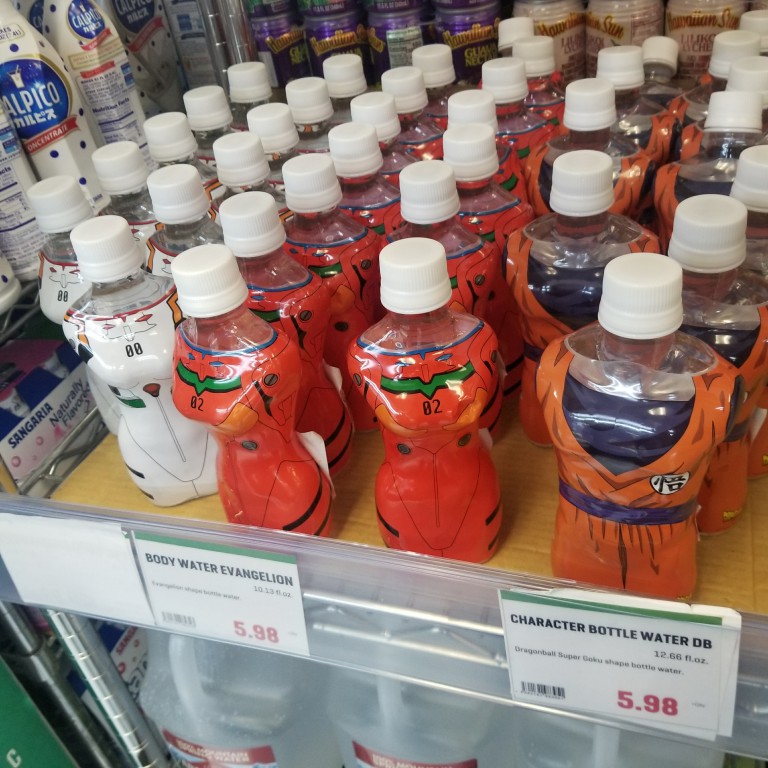
Locate an element on the screen. The height and width of the screenshot is (768, 768). bottom shelf is located at coordinates (319, 737).